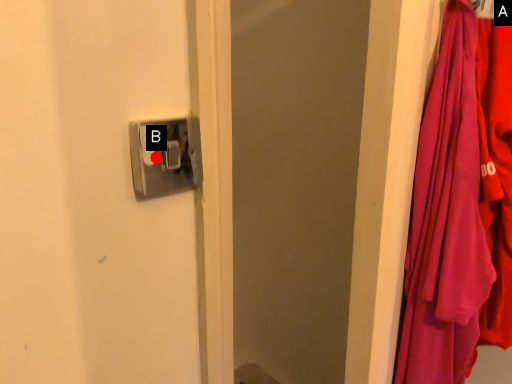
Question: Two points are circled on the image, labeled by A and B beside each circle. Which point is closer to the camera?

Choices:
 (A) A is closer
 (B) B is closer

Answer: (A)